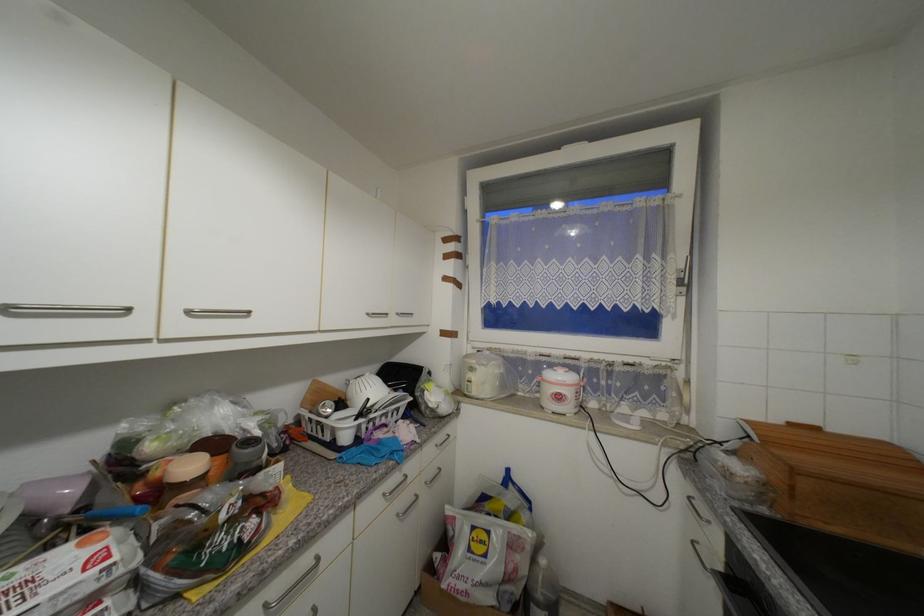
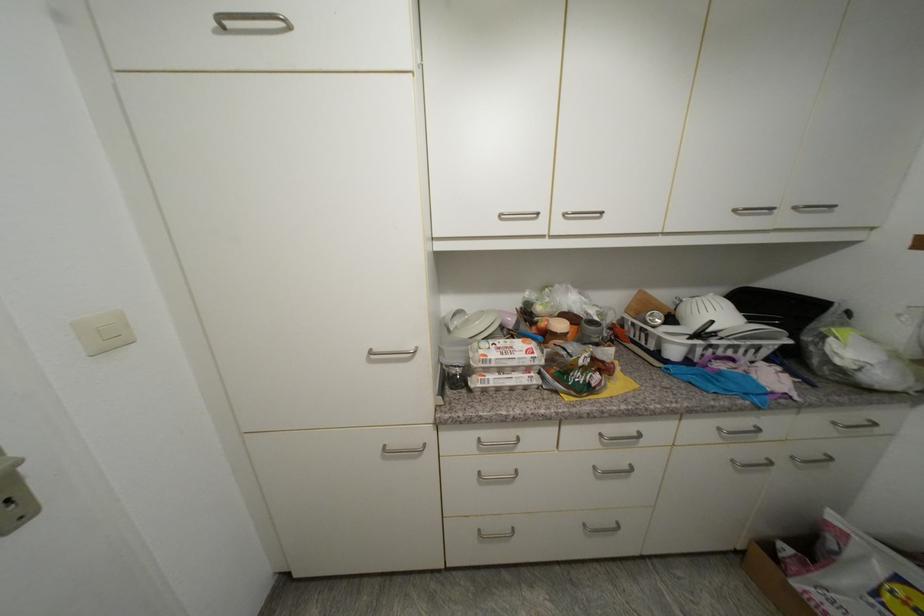
Locate, in the second image, the point that corresponds to (x=373, y=315) in the first image.

(740, 213)